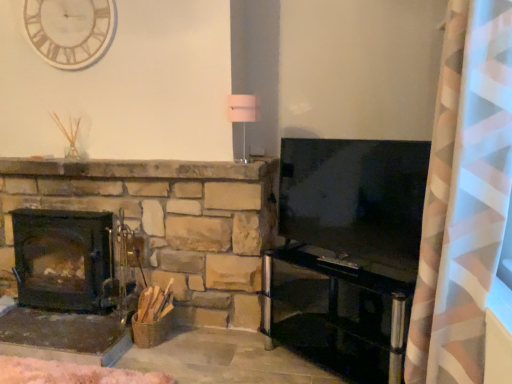
Question: From a real-world perspective, is transparent glass entertainment center at lower right physically located above or below pink/white striped curtain at right?

Choices:
 (A) above
 (B) below

Answer: (B)

Question: From the image's perspective, is transparent glass entertainment center at lower right above or below pink/white striped curtain at right?

Choices:
 (A) below
 (B) above

Answer: (A)

Question: Which object is positioned closest to the transparent glass entertainment center at lower right?

Choices:
 (A) black matte wood burning stove at left
 (B) white wooden clock at upper left
 (C) pink/white striped curtain at right
 (D) flat-screen tv at right

Answer: (D)

Question: Considering the real-world distances, which object is closest to the black matte wood burning stove at left?

Choices:
 (A) transparent glass entertainment center at lower right
 (B) flat-screen tv at right
 (C) pink/white striped curtain at right
 (D) white wooden clock at upper left

Answer: (D)